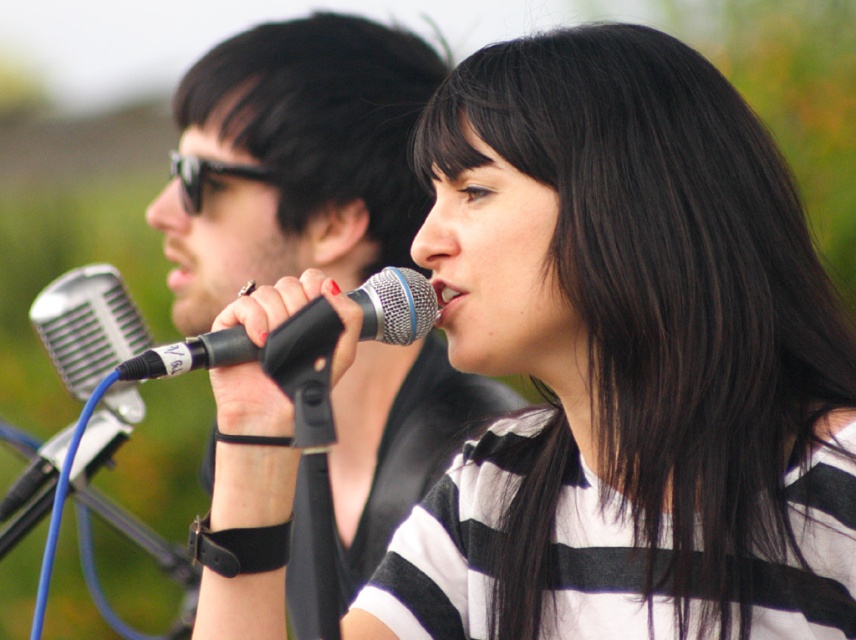
You are a photographer trying to capture a close shot of the black metallic microphone at center. You need to ensure that the black striped shirt at center does not block the microphone in your frame. Based on the scene, can you determine if there is enough space between them to avoid overlap?

The black striped shirt at center and black metallic microphone at center are 5.40 inches apart, so there is sufficient space between them to avoid overlap in your photograph.